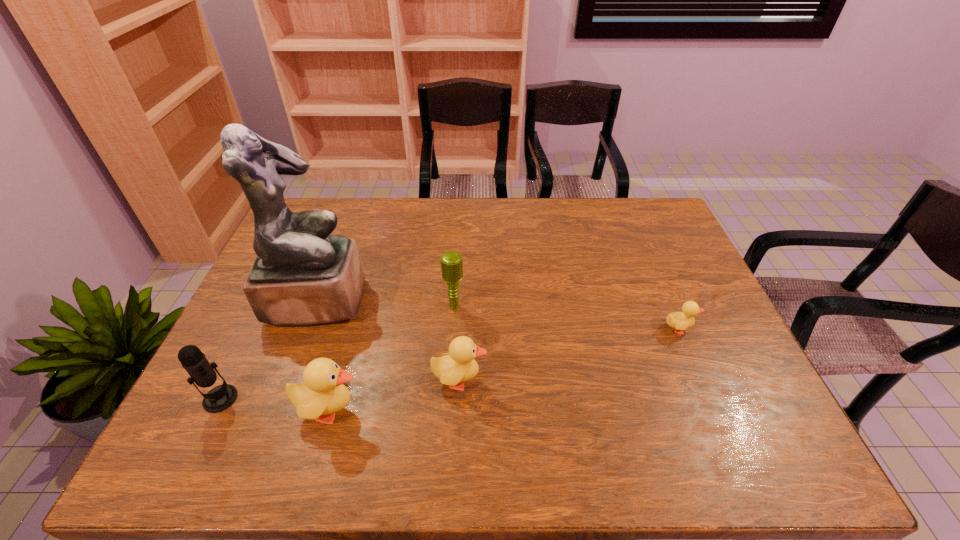
Where is `vacant space located 0.300m in a relaxed pose on the sculpture`? The width and height of the screenshot is (960, 540). vacant space located 0.300m in a relaxed pose on the sculpture is located at coordinates (467, 299).

The image size is (960, 540). Find the location of `vacant space located 0.290m on the right of the farther microphone`. vacant space located 0.290m on the right of the farther microphone is located at coordinates (565, 306).

At what (x,y) coordinates should I click in order to perform the action: click on free space located on the right of the left microphone. Please return your answer as a coordinate pair (x, y). Looking at the image, I should click on (355, 399).

Find the location of a particular element. The image size is (960, 540). microphone that is at the near edge is located at coordinates (221, 397).

You are a GUI agent. You are given a task and a screenshot of the screen. Output one action in this format:
    pyautogui.click(x=<x>, y=<y>)
    Task: Click on the sculpture that is at the left edge
    
    Given the screenshot: What is the action you would take?
    pyautogui.click(x=302, y=275)

I want to click on microphone situated at the left edge, so click(x=221, y=397).

Where is `object that is positioned at the right edge`? object that is positioned at the right edge is located at coordinates (680, 321).

Identify the location of object positioned at the near left corner. The width and height of the screenshot is (960, 540). (221, 397).

This screenshot has width=960, height=540. In order to click on vacant area at the far edge in this screenshot , I will do `click(410, 213)`.

In order to click on vacant area at the near edge in this screenshot , I will do `click(411, 415)`.